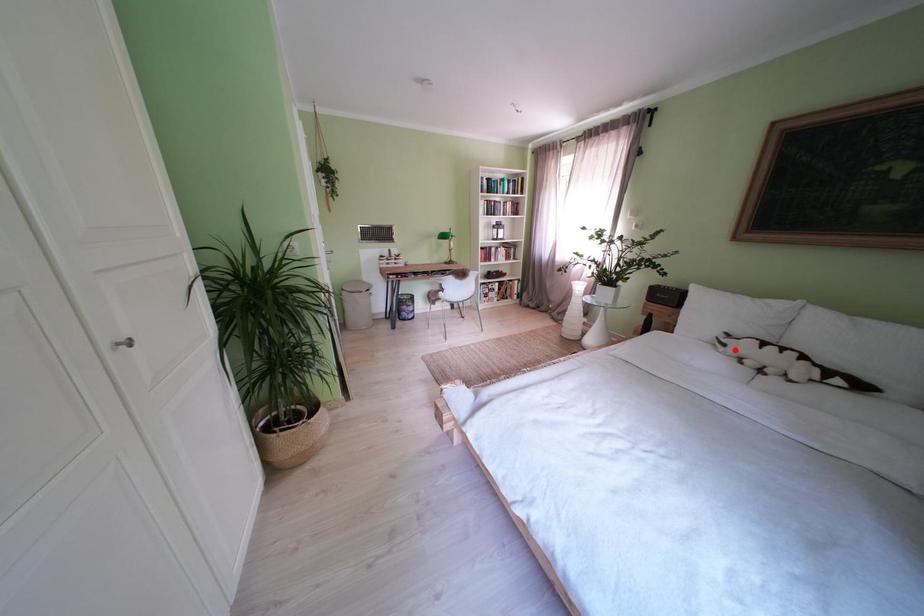
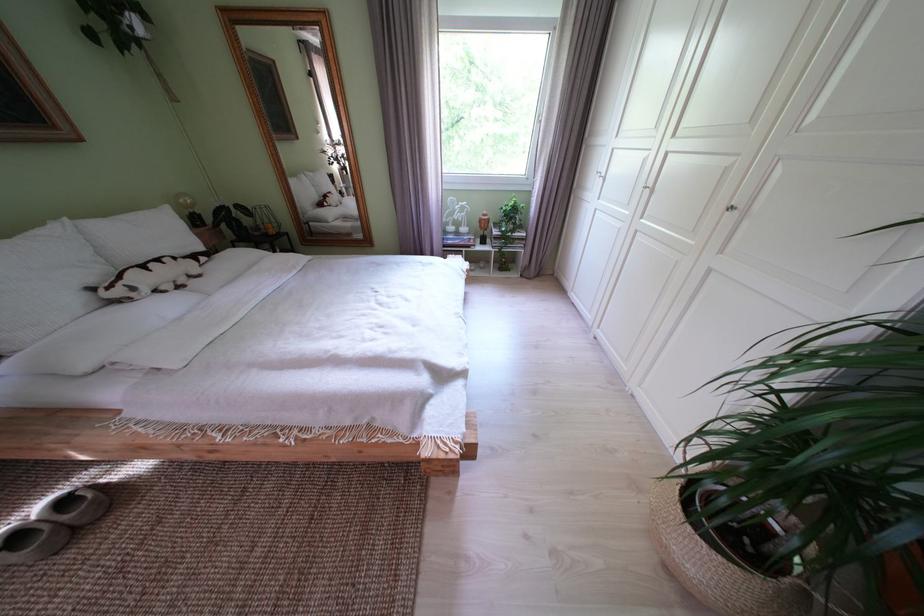
Locate, in the second image, the point that corresponds to the highlighted location in the first image.

(146, 294)